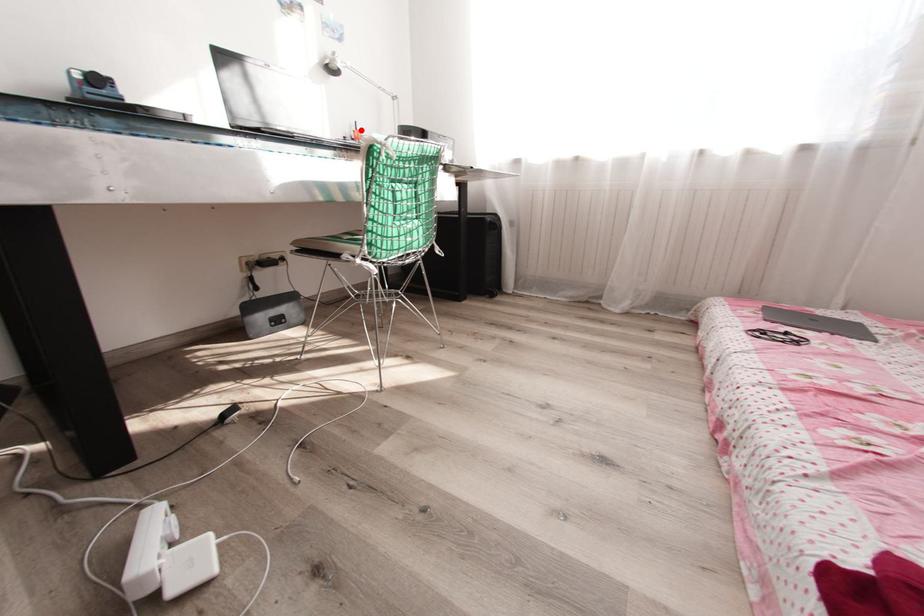
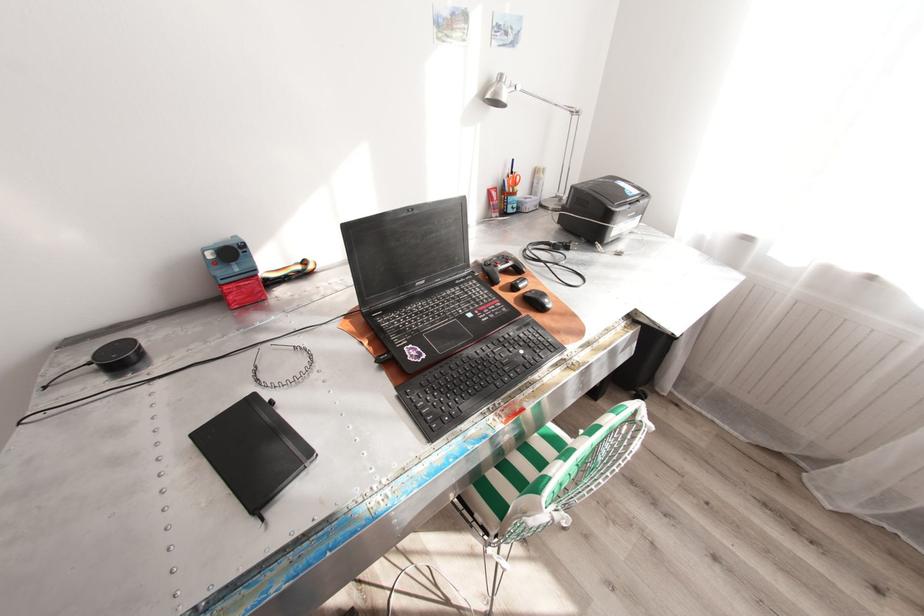
Find the pixel in the second image that matches the highlighted location in the first image.

(517, 172)